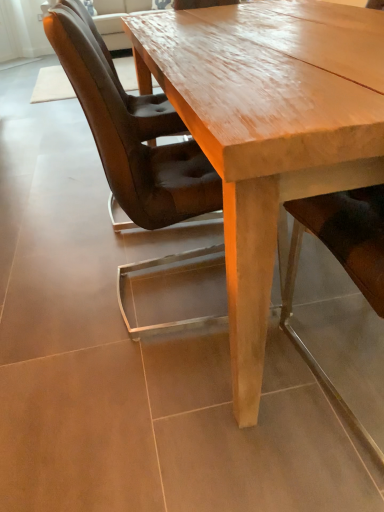
Question: Is smooth leather chair at center, which is the 2th chair from left to right, situated inside light brown polished wood table at center or outside?

Choices:
 (A) outside
 (B) inside

Answer: (B)

Question: Is point (367, 271) closer or farther from the camera than point (309, 83)?

Choices:
 (A) closer
 (B) farther

Answer: (B)

Question: Estimate the real-world distances between objects in this image. Which object is closer to the light brown polished wood table at center?

Choices:
 (A) smooth leather chair at center, positioned as the second chair in back-to-front order
 (B) brown leather chair at left, which appears as the second chair when viewed from the right

Answer: (B)

Question: Which object is positioned farthest from the smooth leather chair at center, positioned as the second chair in back-to-front order?

Choices:
 (A) light brown polished wood table at center
 (B) brown leather chair at left, which appears as the second chair when viewed from the right

Answer: (B)